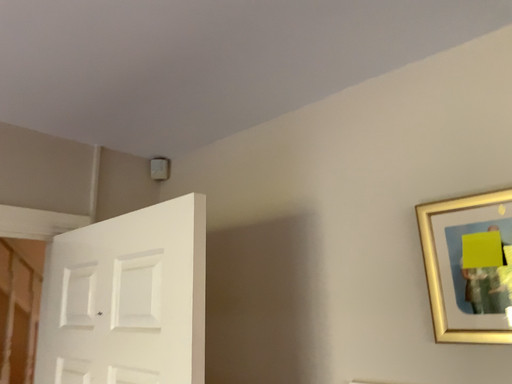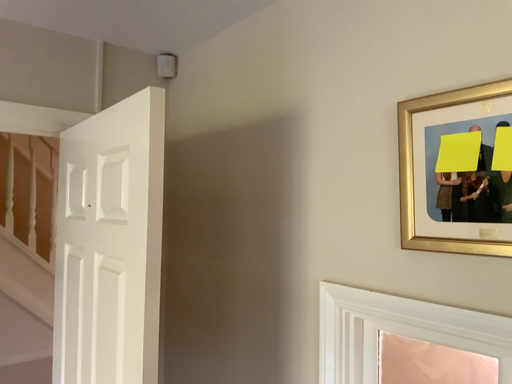
Question: Which way did the camera rotate in the video?

Choices:
 (A) rotated right
 (B) rotated left

Answer: (B)